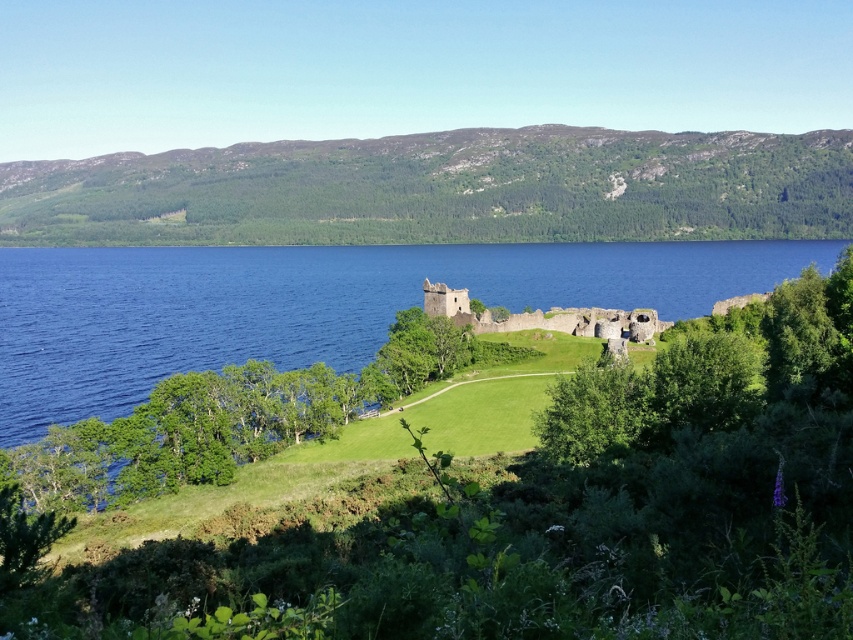
Can you confirm if green leafy tree at center is taller than stone ruins at center?

Yes.

Which is behind, point (26, 483) or point (647, 326)?

Point (647, 326)

This screenshot has width=853, height=640. I want to click on green leafy tree at center, so click(231, 419).

Is green grassy hillside at upper center to the right of green leafy tree at center from the viewer's perspective?

Incorrect, green grassy hillside at upper center is not on the right side of green leafy tree at center.

Is point (416, 195) farther from viewer compared to point (329, 387)?

Yes.

Where is `green grassy hillside at upper center`? green grassy hillside at upper center is located at coordinates (442, 189).

Does green grassy hillside at upper center appear on the right side of stone ruins at center?

No, green grassy hillside at upper center is not to the right of stone ruins at center.

Can you confirm if green grassy hillside at upper center is positioned below stone ruins at center?

No, green grassy hillside at upper center is not below stone ruins at center.

Describe the element at coordinates (442, 189) in the screenshot. The height and width of the screenshot is (640, 853). I see `green grassy hillside at upper center` at that location.

Where is `green grassy hillside at upper center`? green grassy hillside at upper center is located at coordinates (442, 189).